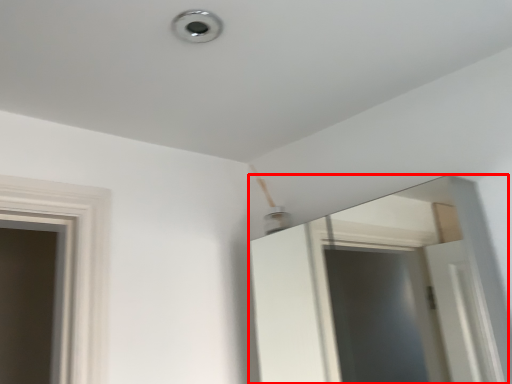
Question: In this image, where is mirror (annotated by the red box) located relative to light?

Choices:
 (A) left
 (B) right

Answer: (B)